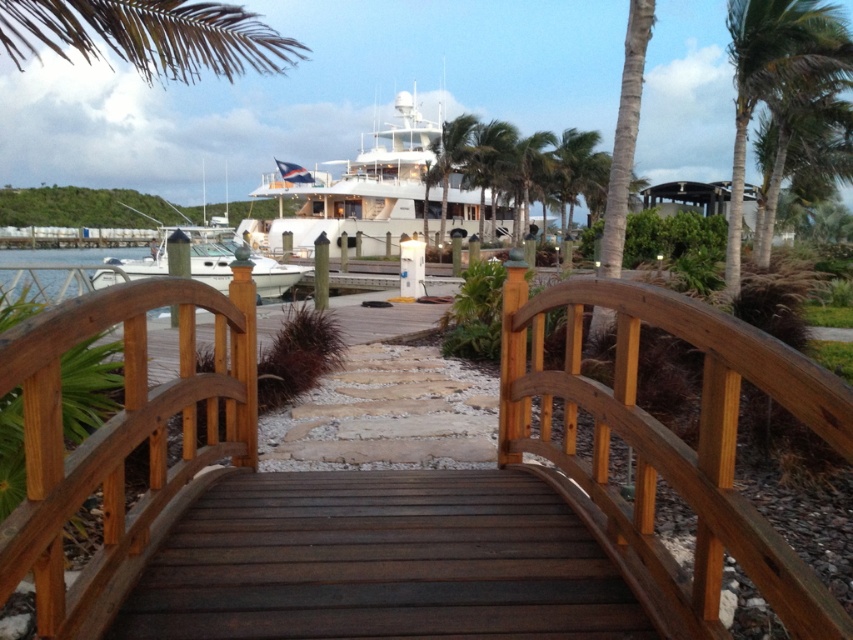
You are standing on the wooden bridge in the foreground and want to locate the white glossy yacht at upper center. Based on its 2D coordinates, in which general direction should you look to find it?

The white glossy yacht at upper center is located at coordinates 0.306 on the x axis and 0.448 on the y axis. Since the x value is less than 0.5, it is positioned to the left of the center horizontally. The y value of 0.448 is also less than 0.5, meaning it is slightly below the vertical center. Therefore, you should look towards the upper left direction to locate it.

You are a photographer planning to capture both the brown wooden bridge at center and the white glossy yacht at upper center in a single frame. Considering their sizes in the image, which object will appear larger in your photograph?

The white glossy yacht at upper center will appear larger in the photograph because it is larger than the brown wooden bridge at center according to the description.